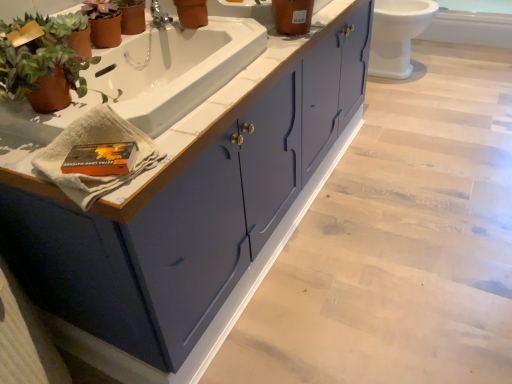
You are a GUI agent. You are given a task and a screenshot of the screen. Output one action in this format:
    pyautogui.click(x=<x>, y=<y>)
    Task: Click on the free point to the right of white glossy toilet at upper right
    This screenshot has height=384, width=512.
    Given the screenshot: What is the action you would take?
    pyautogui.click(x=461, y=71)